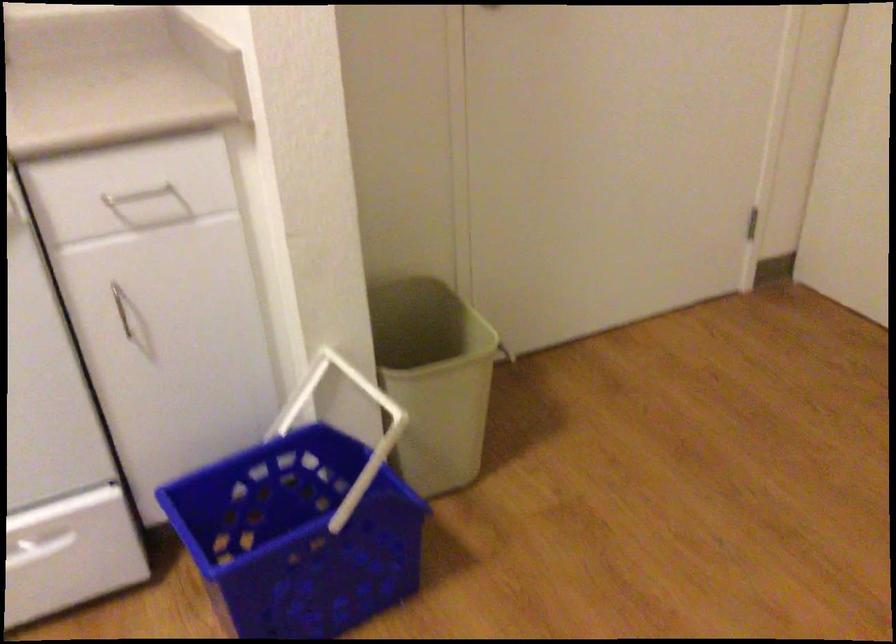
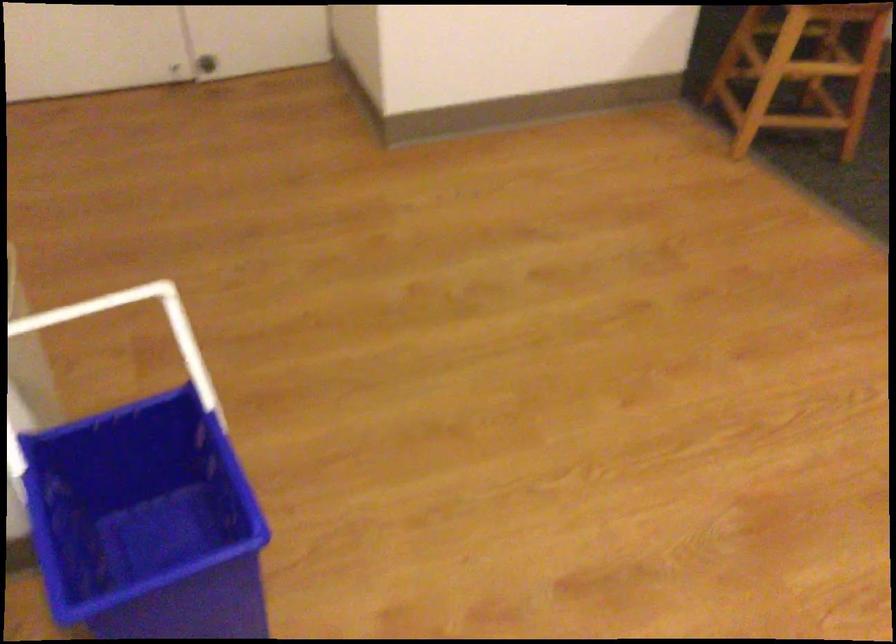
How did the camera likely rotate?

The camera rotated toward right-down.